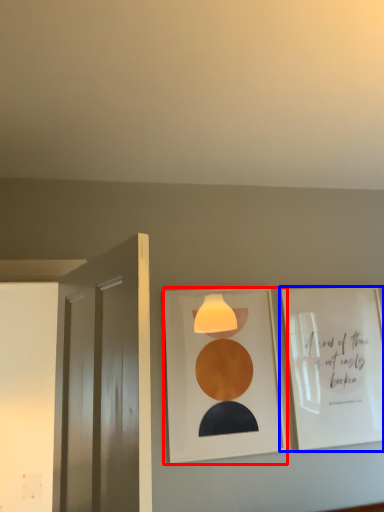
Question: Among these objects, which one is farthest to the camera, picture frame (highlighted by a red box) or picture frame (highlighted by a blue box)?

Choices:
 (A) picture frame
 (B) picture frame

Answer: (B)